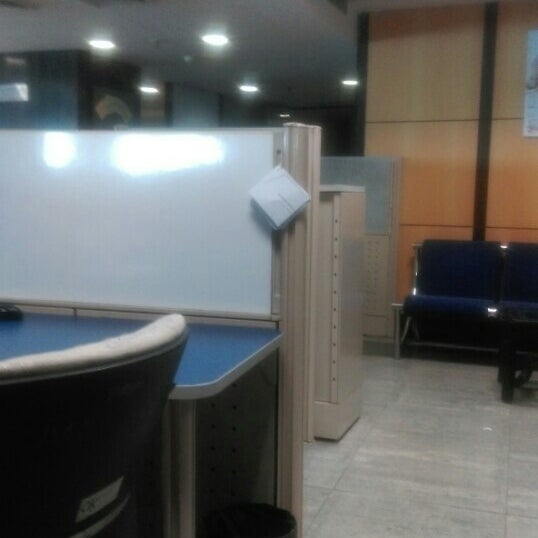
Find the location of a particular element. This screenshot has height=538, width=538. thumb tack is located at coordinates (278, 153).